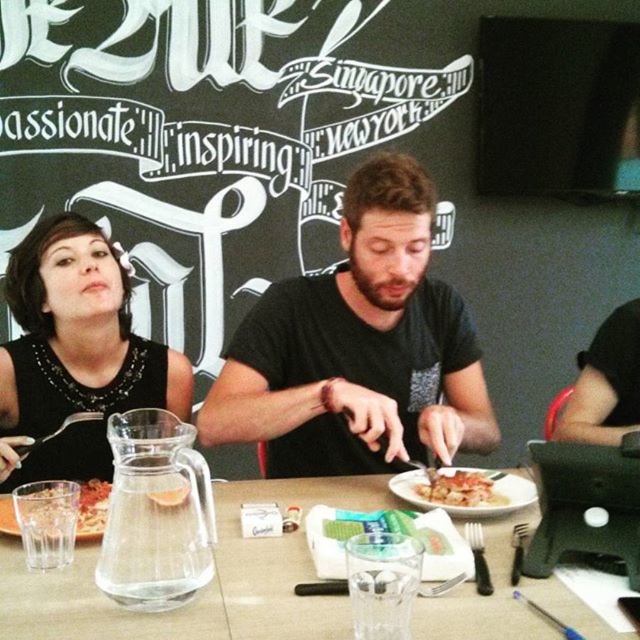
Question: Which of the following is the farthest from the observer?

Choices:
 (A) translucent glass bowl at center
 (B) white glossy plate at center

Answer: (B)

Question: Is white glossy plate at center smaller than golden crispy chicken at center?

Choices:
 (A) no
 (B) yes

Answer: (A)

Question: Can you confirm if clear glass water at center is positioned above translucent glass bowl at center?

Choices:
 (A) no
 (B) yes

Answer: (A)

Question: Does black matte shirt at center have a lesser width compared to white glossy plate at center?

Choices:
 (A) no
 (B) yes

Answer: (A)

Question: Which object is positioned farthest from the clear glass water at center?

Choices:
 (A) black sequined dress at upper left
 (B) white glossy plate at center
 (C) black matte shirt at center
 (D) translucent glass bowl at center

Answer: (A)

Question: Which object is closer to the camera taking this photo?

Choices:
 (A) black sequined dress at upper left
 (B) translucent glass bowl at center
 (C) clear glass water at center
 (D) black matte shirt at center

Answer: (C)